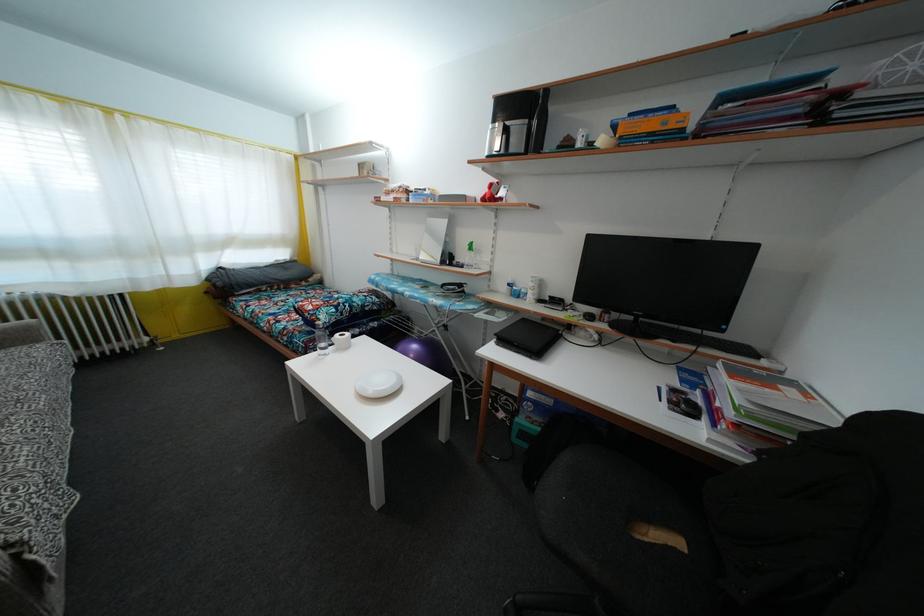
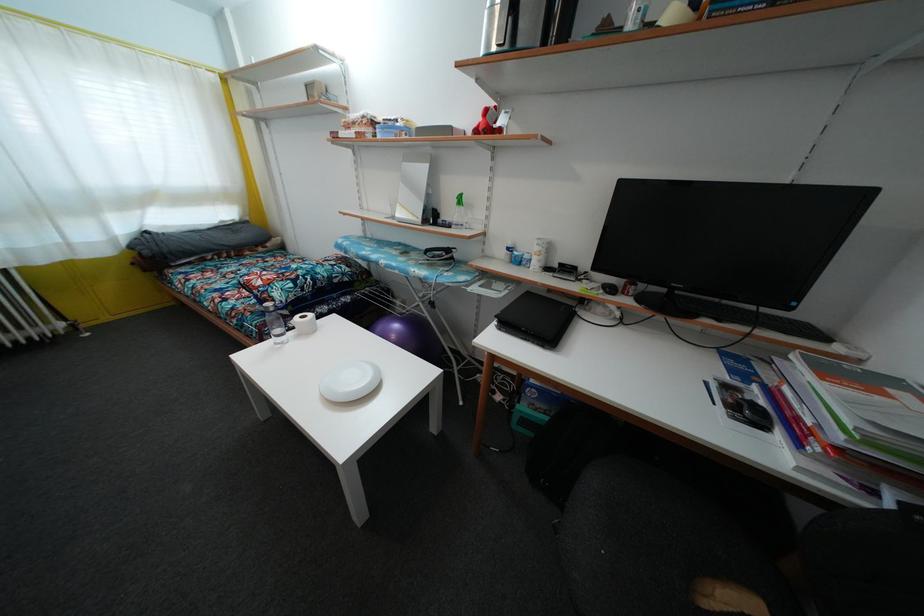
The point at (494, 193) is marked in the first image. Where is the corresponding point in the second image?

(490, 119)